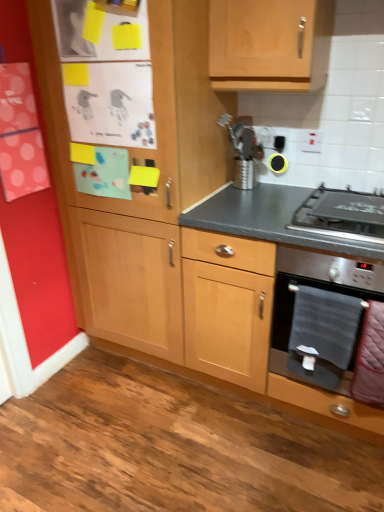
Question: Considering the positions of stainless steel oven at lower right and black rubber earbud at upper center in the image, is stainless steel oven at lower right taller or shorter than black rubber earbud at upper center?

Choices:
 (A) tall
 (B) short

Answer: (A)

Question: Is stainless steel oven at lower right inside the boundaries of black rubber earbud at upper center, or outside?

Choices:
 (A) outside
 (B) inside

Answer: (A)

Question: Based on their relative distances, which object is farther from the stainless steel oven at lower right?

Choices:
 (A) matte wood cabinet at lower right, the second cabinetry when ordered from left to right
 (B) velvet pink blanket at lower right, which is counted as the first blanket, starting from the right
 (C) stainless steel gas stove at lower right
 (D) gray fabric towel at lower right, which is counted as the first blanket, starting from the left
 (E) black rubber earbud at upper center

Answer: (E)

Question: Estimate the real-world distances between objects in this image. Which object is farther from the stainless steel oven at lower right?

Choices:
 (A) gray fabric towel at lower right, which appears as the second blanket when viewed from the right
 (B) stainless steel gas stove at lower right
 (C) velvet pink blanket at lower right, which is counted as the first blanket, starting from the right
 (D) black rubber earbud at upper center
 (E) matte wood cabinet at lower right, which is counted as the 1th cabinetry, starting from the right

Answer: (D)